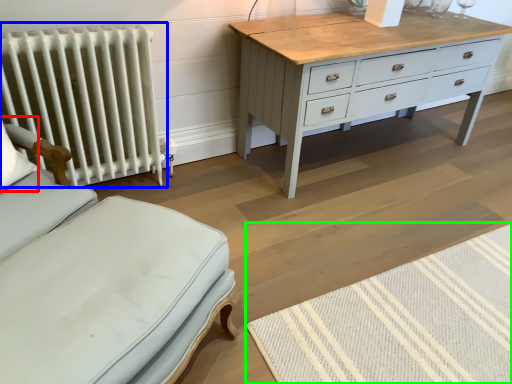
Question: Estimate the real-world distances between objects in this image. Which object is farther from pillow (highlighted by a red box), radiator (highlighted by a blue box) or mat (highlighted by a green box)?

Choices:
 (A) radiator
 (B) mat

Answer: (B)